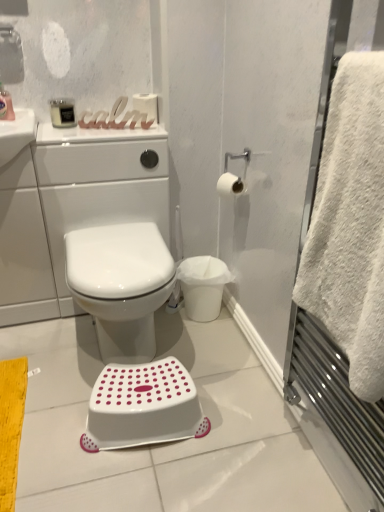
Locate an element on the screen. This screenshot has width=384, height=512. free space in front of white plastic step stool at center is located at coordinates (145, 482).